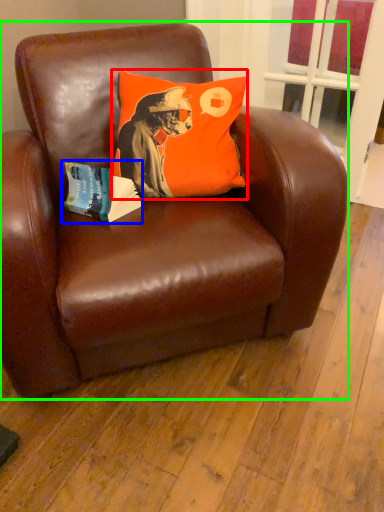
Question: Which is nearer to the pillow (highlighted by a red box)? paperback book (highlighted by a blue box) or chair (highlighted by a green box).

Choices:
 (A) paperback book
 (B) chair

Answer: (A)